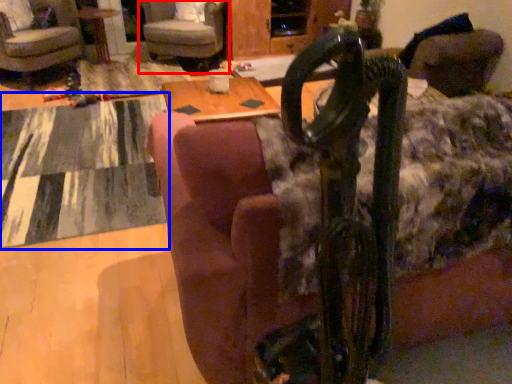
Question: Among these objects, which one is nearest to the camera, chair (highlighted by a red box) or mat (highlighted by a blue box)?

Choices:
 (A) chair
 (B) mat

Answer: (B)